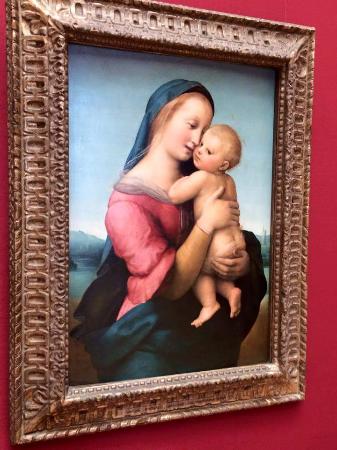
Locate an element on the screen. This screenshot has width=337, height=450. picture frame is located at coordinates (297, 251).